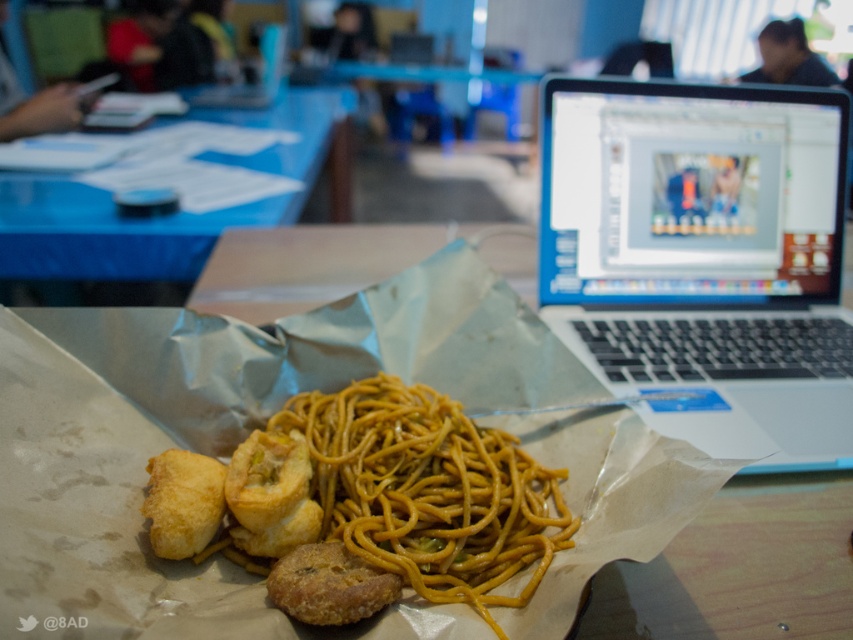
Is silver metallic laptop at upper right bigger than golden crispy fried at center?

Yes, silver metallic laptop at upper right is bigger than golden crispy fried at center.

Is silver metallic laptop at upper right above golden crispy fried at center?

Correct, silver metallic laptop at upper right is located above golden crispy fried at center.

Is point (764, 348) farther from camera compared to point (315, 589)?

Yes, it is behind point (315, 589).

The image size is (853, 640). In order to click on silver metallic laptop at upper right in this screenshot , I will do `click(704, 256)`.

Based on the photo, is the position of yellow matte spaghetti at center more distant than that of golden fried chicken at lower left?

No, yellow matte spaghetti at center is closer to the viewer.

Who is more forward, (373,451) or (194,504)?

Point (194,504) is in front.

Where is `yellow matte spaghetti at center`? yellow matte spaghetti at center is located at coordinates (428, 490).

Is blue plastic table at upper left bigger than golden fried chicken at lower left?

Indeed, blue plastic table at upper left has a larger size compared to golden fried chicken at lower left.

Is point (62, 189) positioned before point (157, 486)?

No, it is behind (157, 486).

The width and height of the screenshot is (853, 640). I want to click on blue plastic table at upper left, so click(x=161, y=216).

Identify the location of blue plastic table at upper left. (161, 216).